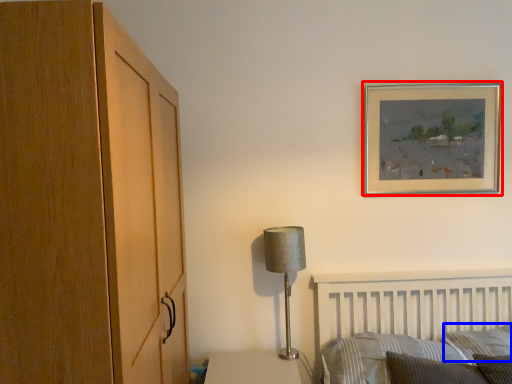
Question: Which of the following is the closest to the observer, picture frame (highlighted by a red box) or pillow (highlighted by a blue box)?

Choices:
 (A) picture frame
 (B) pillow

Answer: (B)